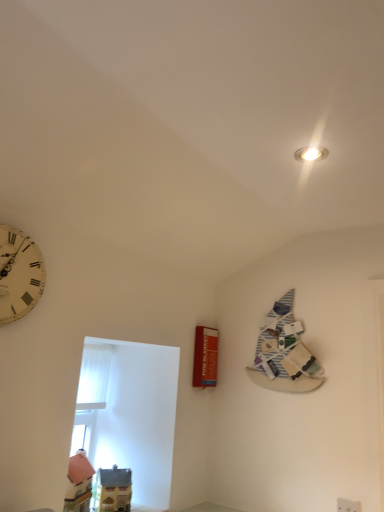
Question: Is white plastic electric outlet at lower right turned away from red matte fire blanket at center-right?

Choices:
 (A) no
 (B) yes

Answer: (A)

Question: Does white plastic electric outlet at lower right have a lesser width compared to red matte fire blanket at center-right?

Choices:
 (A) no
 (B) yes

Answer: (B)

Question: From a real-world perspective, is white plastic electric outlet at lower right on top of red matte fire blanket at center-right?

Choices:
 (A) yes
 (B) no

Answer: (B)

Question: From the image's perspective, is white plastic electric outlet at lower right beneath red matte fire blanket at center-right?

Choices:
 (A) yes
 (B) no

Answer: (A)

Question: Is the surface of white plastic electric outlet at lower right in direct contact with red matte fire blanket at center-right?

Choices:
 (A) no
 (B) yes

Answer: (A)

Question: Is white plastic electric outlet at lower right positioned far away from red matte fire blanket at center-right?

Choices:
 (A) yes
 (B) no

Answer: (B)

Question: Is striped paper book at upper right wider than white plastic electric outlet at lower right?

Choices:
 (A) no
 (B) yes

Answer: (B)

Question: Is striped paper book at upper right taller than white plastic electric outlet at lower right?

Choices:
 (A) no
 (B) yes

Answer: (B)

Question: From the image's perspective, is striped paper book at upper right below white plastic electric outlet at lower right?

Choices:
 (A) no
 (B) yes

Answer: (A)

Question: Can you confirm if striped paper book at upper right is shorter than white plastic electric outlet at lower right?

Choices:
 (A) yes
 (B) no

Answer: (B)

Question: Can you confirm if striped paper book at upper right is bigger than white plastic electric outlet at lower right?

Choices:
 (A) no
 (B) yes

Answer: (B)

Question: Is striped paper book at upper right oriented away from white plastic electric outlet at lower right?

Choices:
 (A) yes
 (B) no

Answer: (B)

Question: Considering the relative sizes of red matte fire blanket at center-right and striped paper book at upper right in the image provided, is red matte fire blanket at center-right bigger than striped paper book at upper right?

Choices:
 (A) no
 (B) yes

Answer: (A)